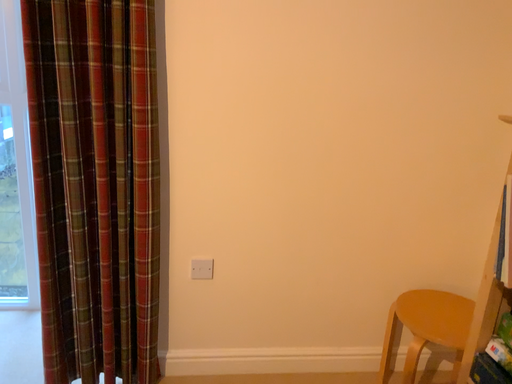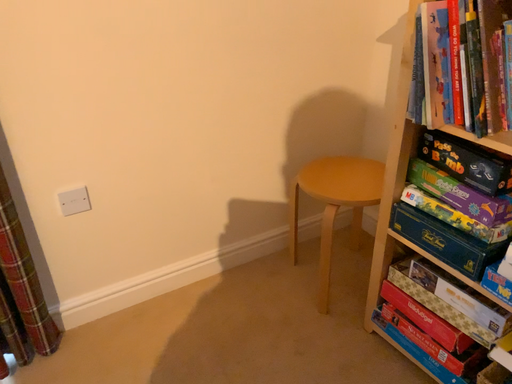
Question: How did the camera likely rotate when shooting the video?

Choices:
 (A) rotated left
 (B) rotated right

Answer: (B)